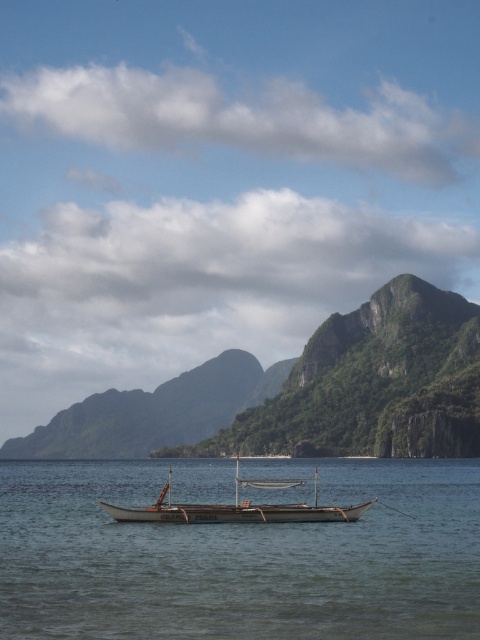
You are a sailor navigating the boat in the image. You need to determine the vertical distance between the clear water at boat center and the green textured mountain at center. Which one has a greater height?

The green textured mountain at center has a greater height than the clear water at boat center.

Looking at this image, you are an observer standing on the shore looking at the coastal scene. Which object, the green textured mountain at center or the wooden boat at center, is positioned higher in the image?

The green textured mountain at center is positioned higher in the image than the wooden boat at center because it is located above it according to the description.